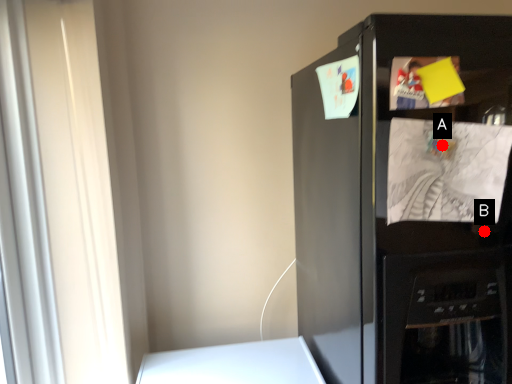
Question: Two points are circled on the image, labeled by A and B beside each circle. Which point appears closest to the camera in this image?

Choices:
 (A) A is closer
 (B) B is closer

Answer: (A)